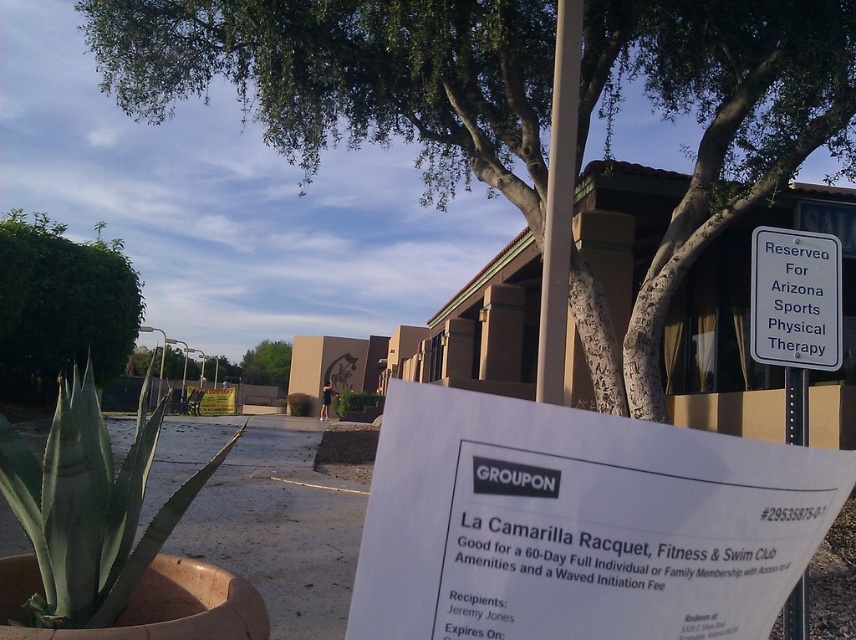
You are a hiker who wants to read the white plastic sign at upper right but notices a green leafy tree at center blocking your view. Can you determine which object is narrower so you know which one you can move aside if needed?

The white plastic sign at upper right is thinner than the green leafy tree at center, so the white plastic sign at upper right is narrower and easier to move aside.

You are standing in the outdoor scene and want to walk from the green leafy tree at upper left to the metallic pole at center. Which direction should you move relative to the tree?

You should move to the right relative to the green leafy tree at upper left because the metallic pole at center is positioned to the right of the tree.